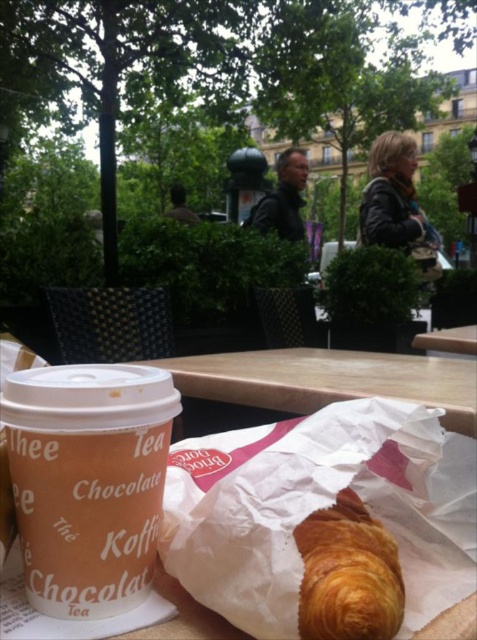
Question: Among these objects, which one is nearest to the camera?

Choices:
 (A) brown paper cup at lower left
 (B) wooden table at center
 (C) golden flaky croissant at center

Answer: (C)

Question: Does brown paper cup at lower left have a greater width compared to golden flaky croissant at center?

Choices:
 (A) no
 (B) yes

Answer: (B)

Question: Is wooden table at center positioned before golden flaky croissant at center?

Choices:
 (A) yes
 (B) no

Answer: (B)

Question: Which of the following is the closest to the observer?

Choices:
 (A) (52, 593)
 (B) (290, 358)

Answer: (A)

Question: Does brown paper cup at lower left have a greater width compared to golden flaky croissant at center?

Choices:
 (A) yes
 (B) no

Answer: (A)

Question: Which point is closer to the camera?

Choices:
 (A) (383, 618)
 (B) (258, 376)
 (C) (100, 524)

Answer: (A)